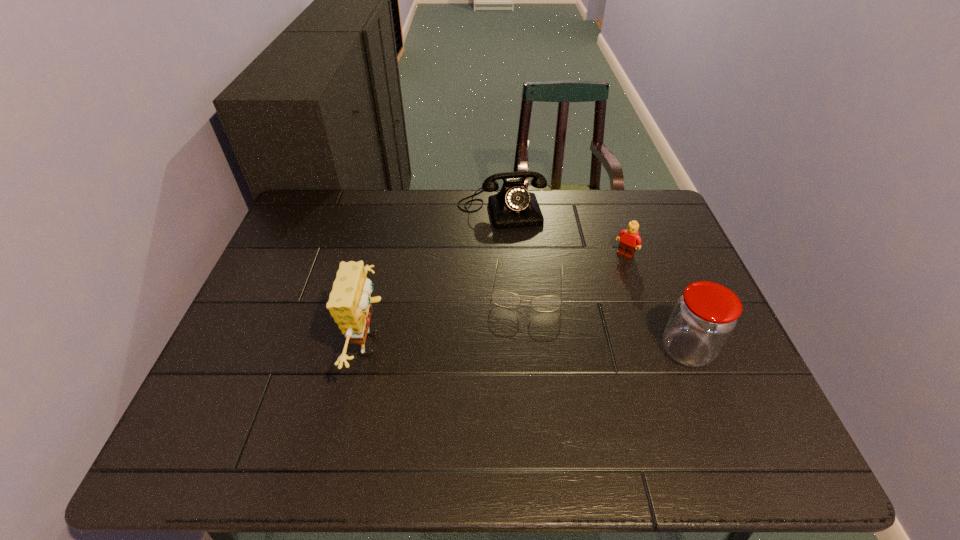
The image size is (960, 540). Identify the location of the tallest object. (349, 304).

Where is `sponge`? This screenshot has width=960, height=540. sponge is located at coordinates (349, 304).

Find the location of a particular element. the fourth shortest object is located at coordinates (704, 317).

I want to click on the farthest object, so click(513, 207).

Find the location of a particular element. Lego is located at coordinates (630, 241).

Where is `the shortest object`? The width and height of the screenshot is (960, 540). the shortest object is located at coordinates (505, 299).

Locate an element on the screen. Image resolution: width=960 pixels, height=540 pixels. vacant region located on the face of the tallest object is located at coordinates (470, 344).

In order to click on vacant space located 0.180m on the back of the second tallest object in this screenshot , I will do `click(658, 278)`.

Where is `vacant space situated 0.070m on the front face of the farthest object`? vacant space situated 0.070m on the front face of the farthest object is located at coordinates coord(513,244).

I want to click on vacant space located 0.320m on the front face of the farthest object, so click(529, 306).